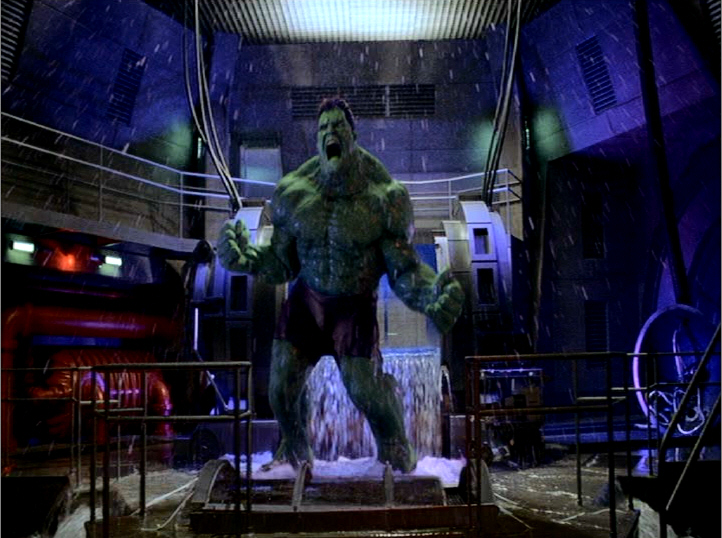
Find the location of a particular element. stairs is located at coordinates (684, 464).